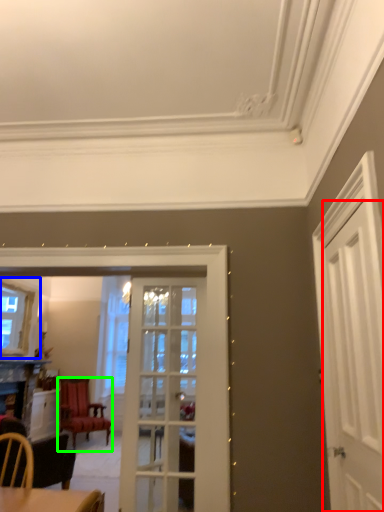
Question: Estimate the real-world distances between objects in this image. Which object is farther from door (highlighted by a red box), window (highlighted by a blue box) or chair (highlighted by a green box)?

Choices:
 (A) window
 (B) chair

Answer: (B)